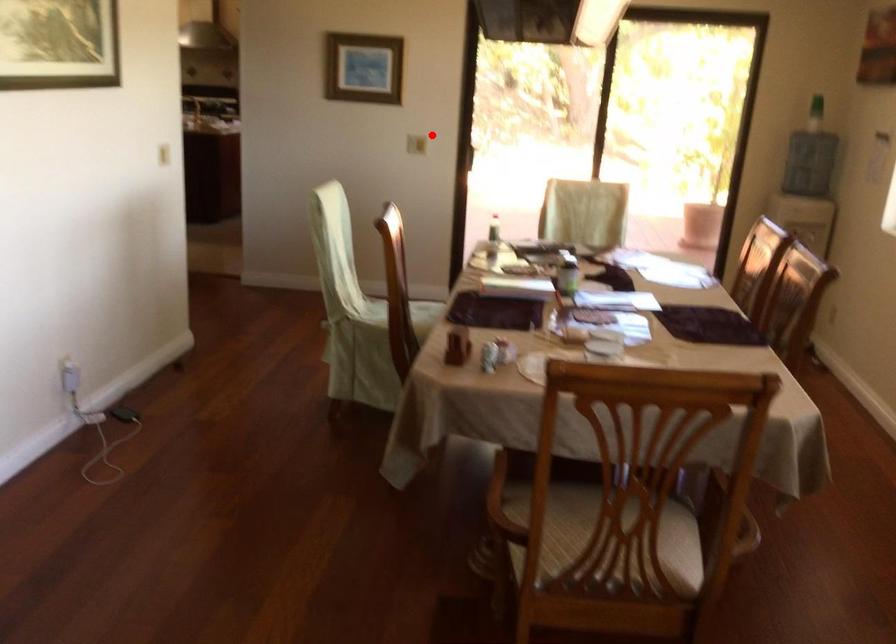
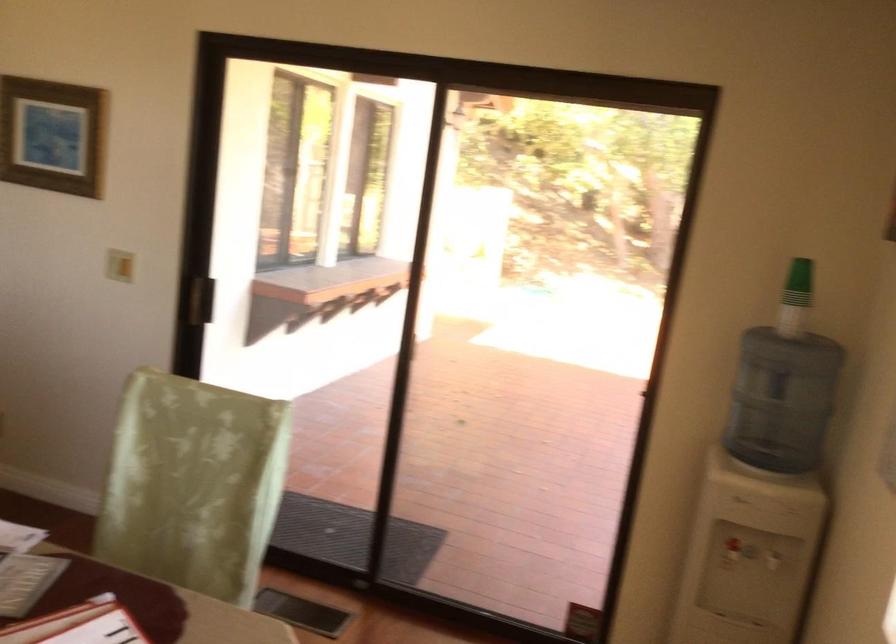
Find the pixel in the second image that matches the highlighted location in the first image.

(119, 265)